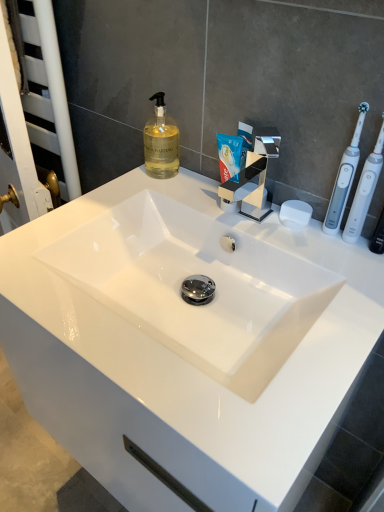
I want to click on vacant space in front of white plastic toothbrush at right, the 2th toothbrush in the right-to-left sequence, so click(343, 283).